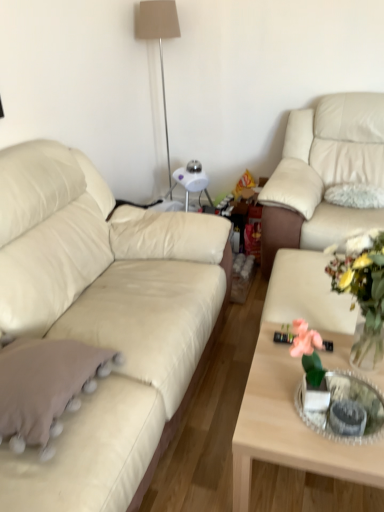
Question: Does beige leather couch at left, the 2th studio couch when ordered from right to left, have a lesser height compared to matte beige lampshade at upper center?

Choices:
 (A) yes
 (B) no

Answer: (A)

Question: Can you confirm if beige leather couch at left, which is counted as the 1th studio couch, starting from the left, is smaller than matte beige lampshade at upper center?

Choices:
 (A) no
 (B) yes

Answer: (A)

Question: Does beige leather couch at left, the 2th studio couch when ordered from right to left, have a larger size compared to matte beige lampshade at upper center?

Choices:
 (A) yes
 (B) no

Answer: (A)

Question: Is beige leather couch at left, which is counted as the 1th studio couch, starting from the left, at the left side of matte beige lampshade at upper center?

Choices:
 (A) yes
 (B) no

Answer: (A)

Question: Is beige leather couch at left, the 2th studio couch when ordered from right to left, far from matte beige lampshade at upper center?

Choices:
 (A) no
 (B) yes

Answer: (B)

Question: From a real-world perspective, is light wood coffee table at center physically located above or below beige fabric throw pillow at lower left?

Choices:
 (A) below
 (B) above

Answer: (A)

Question: Is light wood coffee table at center in front of or behind beige fabric throw pillow at lower left in the image?

Choices:
 (A) front
 (B) behind

Answer: (B)

Question: In terms of width, does light wood coffee table at center look wider or thinner when compared to beige fabric throw pillow at lower left?

Choices:
 (A) wide
 (B) thin

Answer: (A)

Question: Based on their positions, is light wood coffee table at center located to the left or right of beige fabric throw pillow at lower left?

Choices:
 (A) right
 (B) left

Answer: (A)

Question: Considering the positions of point (319, 104) and point (135, 33), is point (319, 104) closer or farther from the camera than point (135, 33)?

Choices:
 (A) closer
 (B) farther

Answer: (A)

Question: In terms of height, does beige leather couch at right, the 1th studio couch from the right, look taller or shorter compared to matte beige lampshade at upper center?

Choices:
 (A) short
 (B) tall

Answer: (A)

Question: From the image's perspective, is beige leather couch at right, which appears as the second studio couch when viewed from the left, located above or below matte beige lampshade at upper center?

Choices:
 (A) below
 (B) above

Answer: (A)

Question: Is beige leather couch at right, the 1th studio couch from the right, in front of or behind matte beige lampshade at upper center in the image?

Choices:
 (A) front
 (B) behind

Answer: (A)

Question: Is beige leather couch at right, which appears as the second studio couch when viewed from the left, wider or thinner than translucent glass vase at center?

Choices:
 (A) wide
 (B) thin

Answer: (A)

Question: Is beige leather couch at right, the 1th studio couch from the right, spatially inside translucent glass vase at center, or outside of it?

Choices:
 (A) outside
 (B) inside

Answer: (A)